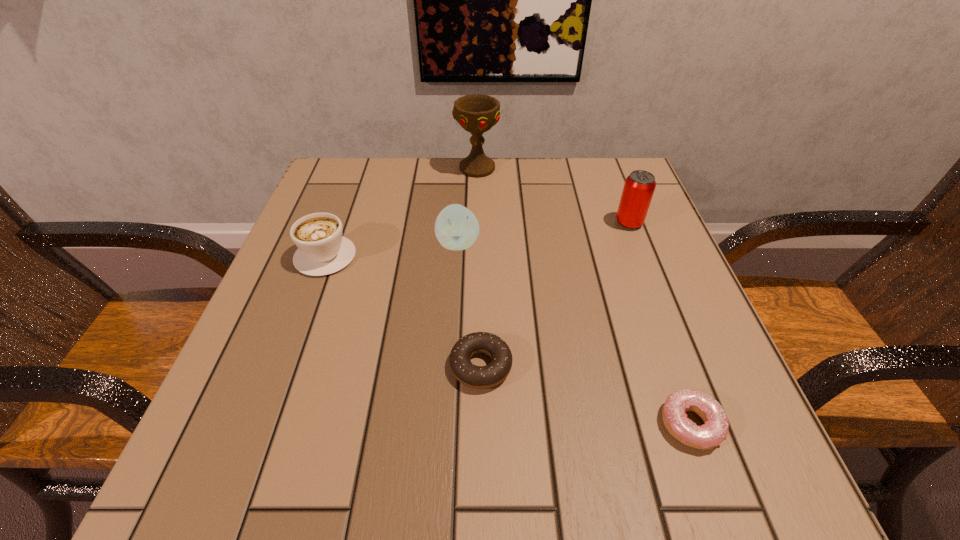
This screenshot has width=960, height=540. In order to click on object situated at the near edge in this screenshot , I will do `click(714, 430)`.

The image size is (960, 540). Find the location of `object that is positioned at the left edge`. object that is positioned at the left edge is located at coordinates (322, 250).

The width and height of the screenshot is (960, 540). In order to click on can at the right edge in this screenshot , I will do `click(639, 187)`.

Identify the location of doughnut situated at the right edge. (714, 430).

This screenshot has width=960, height=540. I want to click on object positioned at the far right corner, so click(x=639, y=187).

What are the coordinates of `object situated at the near right corner` in the screenshot? It's located at click(x=714, y=430).

This screenshot has width=960, height=540. I want to click on vacant area at the far edge of the desktop, so click(477, 202).

You are a GUI agent. You are given a task and a screenshot of the screen. Output one action in this format:
    pyautogui.click(x=<x>, y=<y>)
    Task: Click on the free space at the near edge of the desktop
    This screenshot has width=960, height=540.
    Given the screenshot: What is the action you would take?
    pyautogui.click(x=643, y=461)

In the image, there is a desktop. Identify the location of vacant space at the left edge. (340, 356).

The image size is (960, 540). In the image, there is a desktop. In order to click on vacant region at the right edge in this screenshot , I will do `click(625, 306)`.